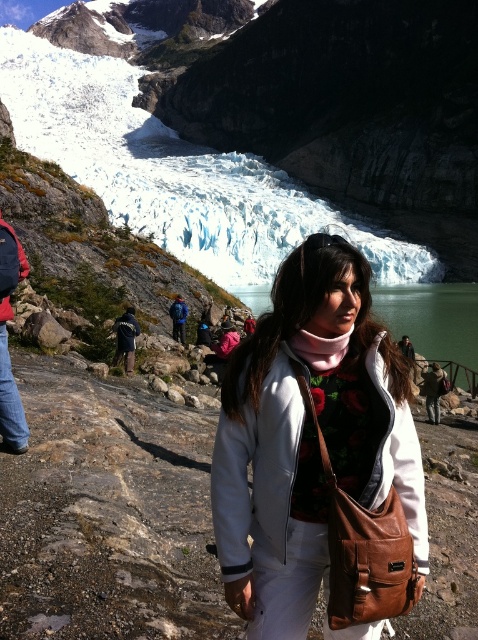
You are standing at the point marked as point [3,54] and want to move towards the glacier in the background. Is the point marked as point [366,410] located between you and the glacier?

Yes, point [366,410] is between you and the glacier because it is closer to the viewer than point [3,54], which is your current position.